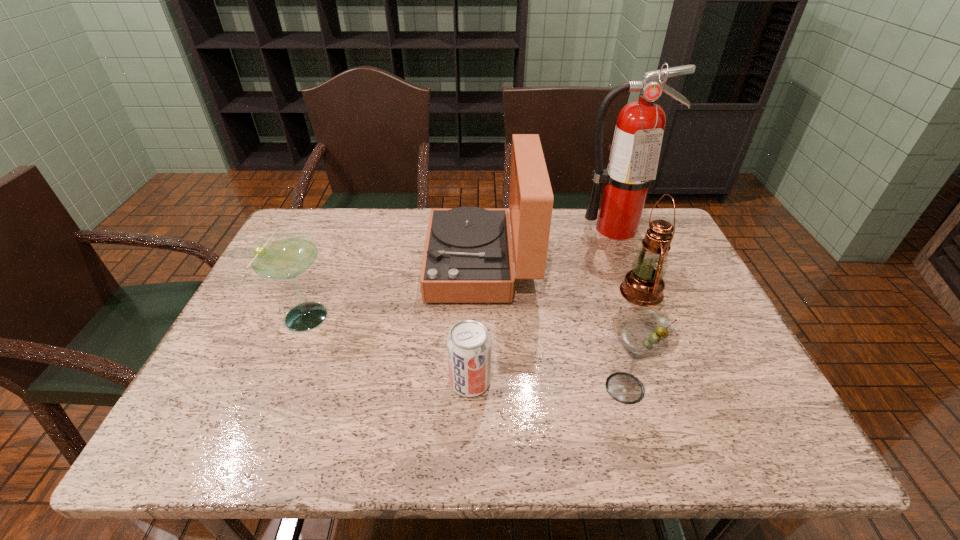
Image resolution: width=960 pixels, height=540 pixels. Identify the location of fire extinguisher. (635, 151).

The width and height of the screenshot is (960, 540). What are the coordinates of `phonograph record` in the screenshot? It's located at (467, 258).

Locate an element on the screen. The image size is (960, 540). oil lamp is located at coordinates (643, 285).

Locate an element on the screen. This screenshot has width=960, height=540. the farther martini is located at coordinates (284, 255).

What are the coordinates of `the leftmost object` in the screenshot? It's located at (284, 255).

Locate an element on the screen. This screenshot has height=540, width=960. the right martini is located at coordinates (643, 333).

The image size is (960, 540). What are the coordinates of `soda can` in the screenshot? It's located at point(468,344).

At what (x,y) coordinates should I click in order to perform the action: click on free space located on the nozzle side of the tallest object. Please return your answer as a coordinate pair (x, y). The image size is (960, 540). Looking at the image, I should click on (644, 300).

Identify the location of vacant space situated 0.260m on the face of the phonograph record. Image resolution: width=960 pixels, height=540 pixels. (335, 265).

Locate an element on the screen. This screenshot has width=960, height=540. free space located 0.210m on the face of the phonograph record is located at coordinates (353, 265).